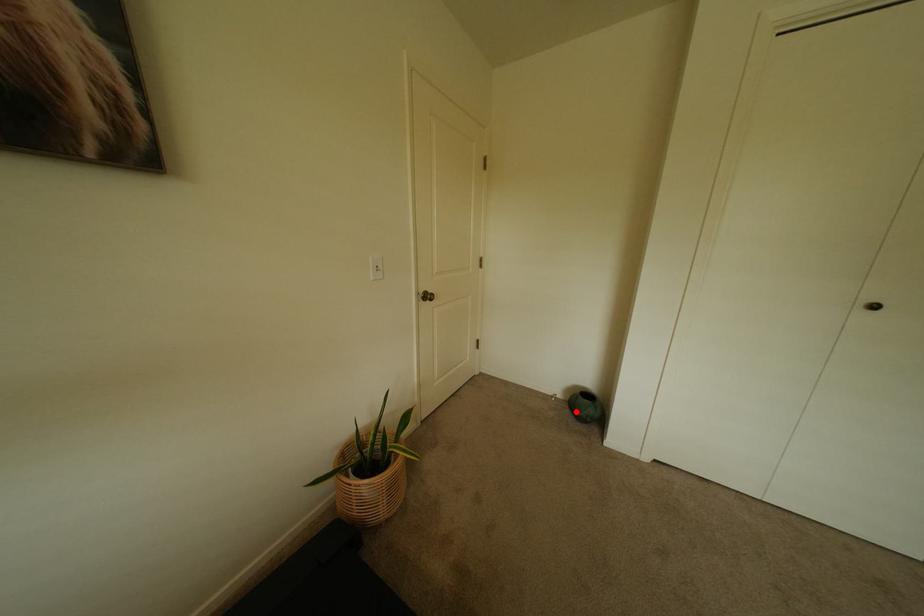
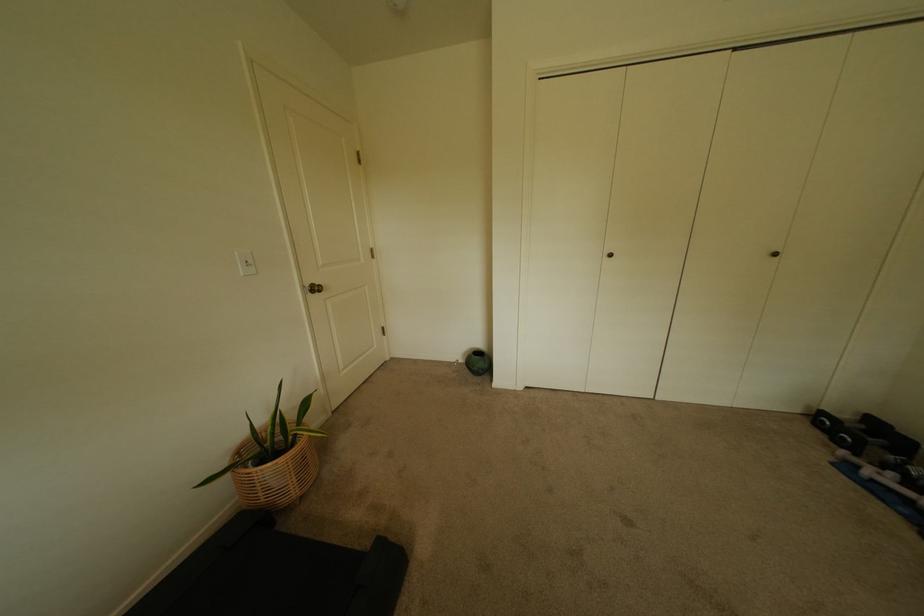
Question: I am providing you with two images of the same scene from different viewpoints. A red point is marked on the first image. At the location where the point appears in image 1, is it still visible in image 2?

Choices:
 (A) Yes
 (B) No

Answer: (A)